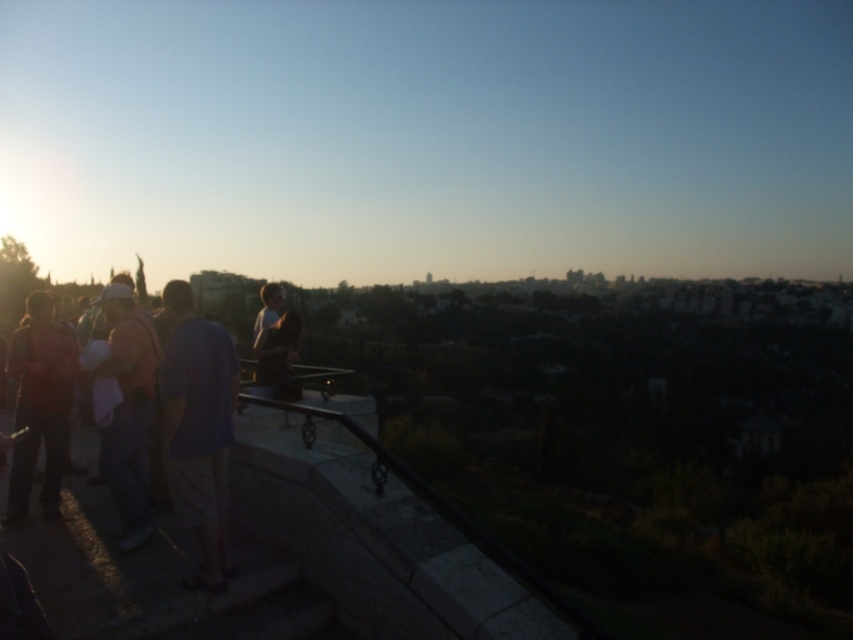
You are a photographer trying to capture a photo of two people wearing light brown fabric shirt at left and matte black shirt at left. Since the sunlight is casting long shadows, you want to ensure both subjects are fully illuminated. Based on their positions, which shirt is more likely to be in the shadow?

The matte black shirt at left is shorter than the light brown fabric shirt at left, so it is more likely to be in the shadow since it is shorter and the sun is lower in the sky.

You are standing at the viewpoint overlooking the city and want to take a photo. You notice two points marked on the railing. The first point is at coordinate point(141, 358) and the second is at point(45, 461). If you want to position yourself closer to the front point, which coordinate should you stand near?

You should stand near point(141, 358) because it is in front of point(45, 461), making it closer to the viewpoint.

You are standing on the stone staircase overlooking the city during sunset. You notice two points marked on the railing. The first point is at coordinate point (231, 392) and the second is at point (56, 372). If you want to move from the first point to the second point along the railing, will you be moving towards the viewer or away from the viewer?

Point (231, 392) is in front of point (56, 372), so moving from the first point to the second point along the railing would mean moving away from the viewer.